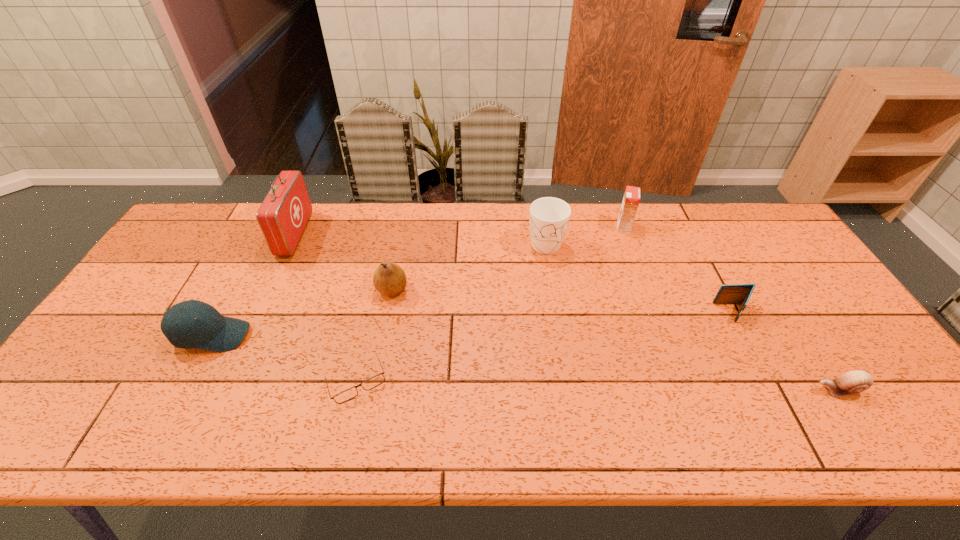
Where is `the first-aid kit that is at the far edge`? the first-aid kit that is at the far edge is located at coordinates (283, 215).

This screenshot has width=960, height=540. I want to click on mug that is at the far edge, so click(x=549, y=217).

Find the location of a particular element. orange juice at the far edge is located at coordinates (631, 199).

The image size is (960, 540). I want to click on object located at the right edge, so click(855, 381).

In order to click on vacant region at the far edge in this screenshot , I will do `click(455, 205)`.

The image size is (960, 540). What are the coordinates of `vacant space at the near edge` in the screenshot? It's located at (769, 434).

Where is `free space at the left edge of the desktop`? free space at the left edge of the desktop is located at coordinates (120, 362).

The image size is (960, 540). Identify the location of vacant region at the right edge. (798, 316).

Image resolution: width=960 pixels, height=540 pixels. In order to click on vacant space that's between the wallet and the baseball cap in this screenshot , I will do `click(473, 324)`.

The height and width of the screenshot is (540, 960). What are the coordinates of `vacant area that lies between the shortest object and the baseball cap` in the screenshot? It's located at (284, 359).